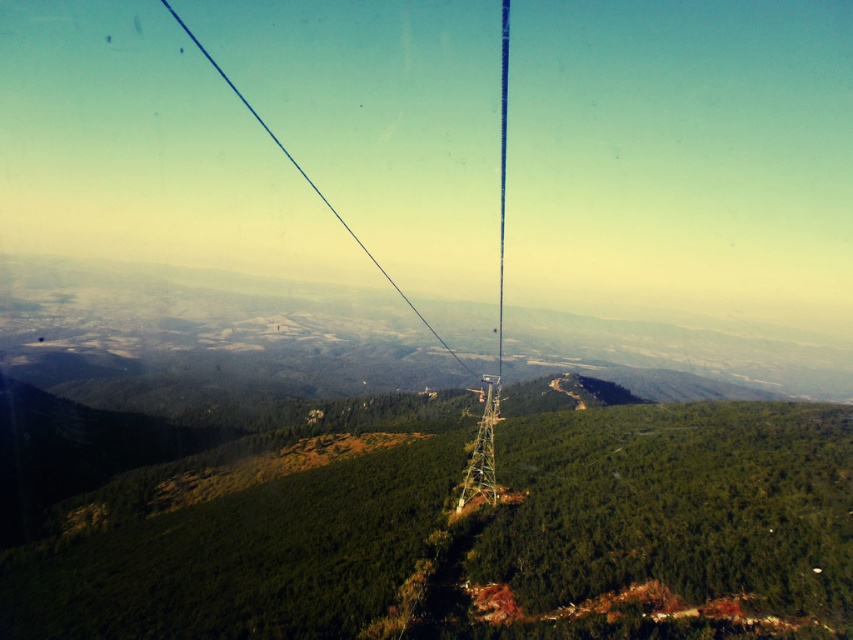
Can you confirm if blue wire at center is positioned above metallic silver cable at center?

Incorrect, blue wire at center is not positioned above metallic silver cable at center.

Image resolution: width=853 pixels, height=640 pixels. In order to click on blue wire at center in this screenshot , I will do `click(309, 180)`.

Measure the distance between point (187, 29) and camera.

849.89 meters

Locate an element on the screen. Image resolution: width=853 pixels, height=640 pixels. blue wire at center is located at coordinates (309, 180).